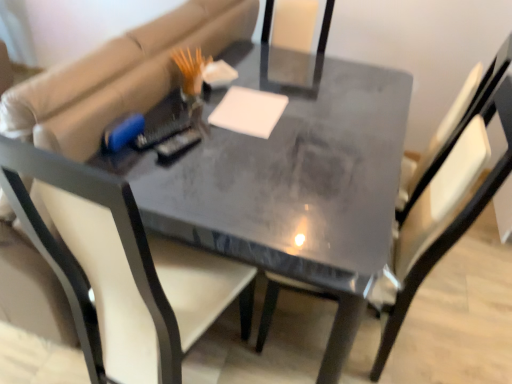
Question: Is matte gray table at center facing towards matte gray chair at center, which is the 2th chair from left to right?

Choices:
 (A) no
 (B) yes

Answer: (B)

Question: From a real-world perspective, is matte gray table at center located higher than matte gray chair at center, which is the first chair in right-to-left order?

Choices:
 (A) yes
 (B) no

Answer: (B)

Question: Is matte gray table at center thinner than matte gray chair at center, which is the 2th chair from left to right?

Choices:
 (A) no
 (B) yes

Answer: (A)

Question: From the image's perspective, is matte gray table at center on matte gray chair at center, which is the first chair in right-to-left order?

Choices:
 (A) yes
 (B) no

Answer: (A)

Question: Is matte gray table at center positioned behind matte gray chair at center, which is the 2th chair from left to right?

Choices:
 (A) yes
 (B) no

Answer: (A)

Question: Is white matte notepad at center in front of or behind matte gray chair at center, which is the 2th chair from left to right, in the image?

Choices:
 (A) behind
 (B) front

Answer: (A)

Question: In terms of width, does white matte notepad at center look wider or thinner when compared to matte gray chair at center, which is the 2th chair from left to right?

Choices:
 (A) wide
 (B) thin

Answer: (B)

Question: Considering the relative positions of white matte notepad at center and matte gray chair at center, which is the 2th chair from left to right, in the image provided, is white matte notepad at center to the left or to the right of matte gray chair at center, which is the 2th chair from left to right,?

Choices:
 (A) left
 (B) right

Answer: (A)

Question: Which is correct: white matte notepad at center is inside matte gray chair at center, which is the 2th chair from left to right, or outside of it?

Choices:
 (A) inside
 (B) outside

Answer: (B)

Question: Considering the positions of matte gray table at center and matte gray chair at center, which is the 2th chair from left to right, in the image, is matte gray table at center bigger or smaller than matte gray chair at center, which is the 2th chair from left to right,?

Choices:
 (A) big
 (B) small

Answer: (A)

Question: Would you say matte gray table at center is to the left or to the right of matte gray chair at center, which is the first chair in right-to-left order, in the picture?

Choices:
 (A) right
 (B) left

Answer: (B)

Question: From their relative heights in the image, would you say matte gray table at center is taller or shorter than matte gray chair at center, which is the first chair in right-to-left order?

Choices:
 (A) short
 (B) tall

Answer: (A)

Question: Considering the positions of point (370, 82) and point (501, 120), is point (370, 82) closer or farther from the camera than point (501, 120)?

Choices:
 (A) farther
 (B) closer

Answer: (A)

Question: Considering the positions of matte gray table at center and white matte notepad at center in the image, is matte gray table at center bigger or smaller than white matte notepad at center?

Choices:
 (A) small
 (B) big

Answer: (B)

Question: Is matte gray table at center taller or shorter than white matte notepad at center?

Choices:
 (A) tall
 (B) short

Answer: (A)